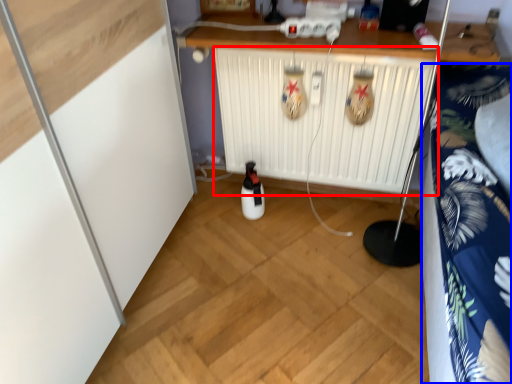
Question: Which object appears farthest to the camera in this image, radiator (highlighted by a red box) or bedding (highlighted by a blue box)?

Choices:
 (A) radiator
 (B) bedding

Answer: (A)